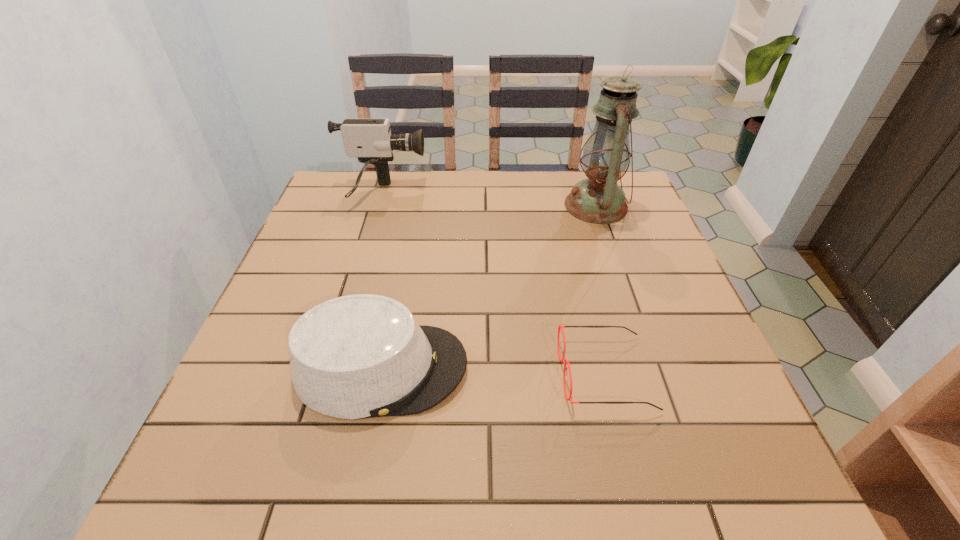
The image size is (960, 540). What are the coordinates of `vacant area at the left edge of the desktop` in the screenshot? It's located at (234, 415).

Where is `free space at the right edge of the desktop`? free space at the right edge of the desktop is located at coordinates (660, 263).

Find the location of a particular element. Image resolution: width=960 pixels, height=540 pixels. vacant space at the far left corner is located at coordinates (352, 174).

This screenshot has height=540, width=960. I want to click on free region at the near right corner of the desktop, so click(x=743, y=485).

Identify the location of free spot between the spectacles and the third shortest object. (493, 284).

The image size is (960, 540). I want to click on vacant area that lies between the third tallest object and the second tallest object, so click(x=381, y=281).

At what (x,y) coordinates should I click in order to perform the action: click on free space between the camcorder and the oil lamp. Please return your answer as a coordinate pair (x, y). The height and width of the screenshot is (540, 960). Looking at the image, I should click on (489, 200).

You are a GUI agent. You are given a task and a screenshot of the screen. Output one action in this format:
    pyautogui.click(x=<x>, y=<y>)
    Task: Click on the free point between the third shortest object and the shortest object
    The width and height of the screenshot is (960, 540).
    Given the screenshot: What is the action you would take?
    pyautogui.click(x=493, y=284)

The image size is (960, 540). Find the location of `free space between the spectacles and the oil lamp`. free space between the spectacles and the oil lamp is located at coordinates (600, 289).

Locate an element on the screen. This screenshot has height=540, width=960. free space between the camcorder and the hat is located at coordinates (381, 281).